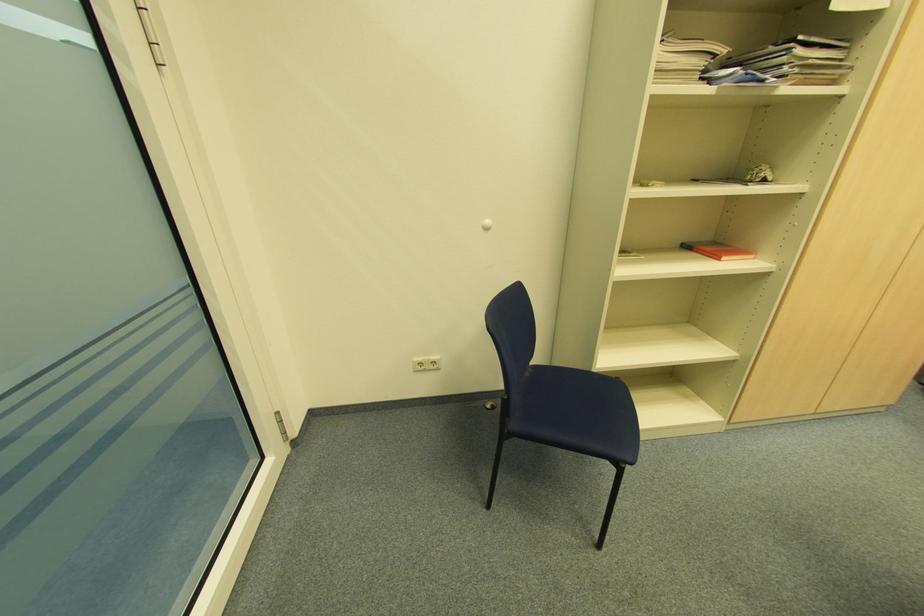
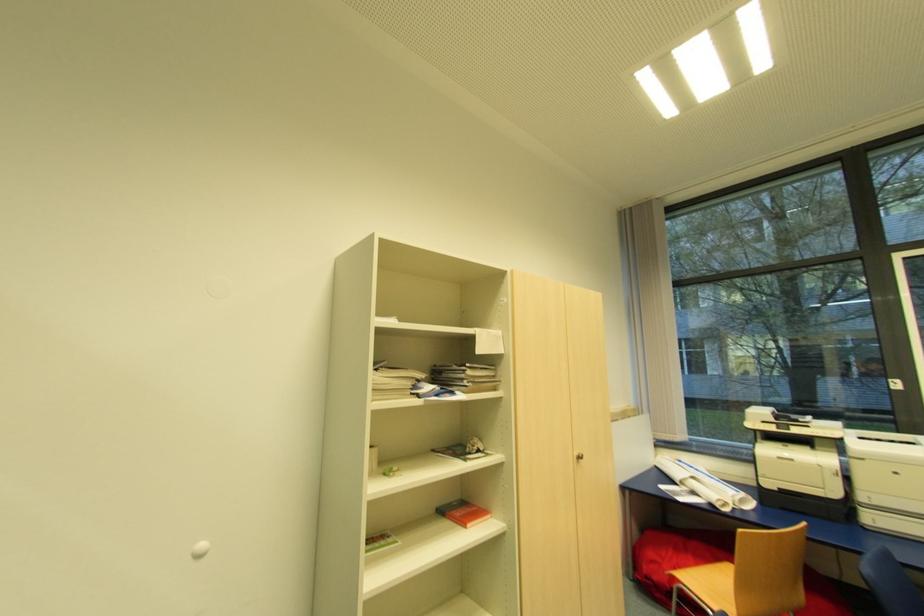
Based on the continuous images, in which direction is the camera rotating?

The camera's rotation is toward right-up.